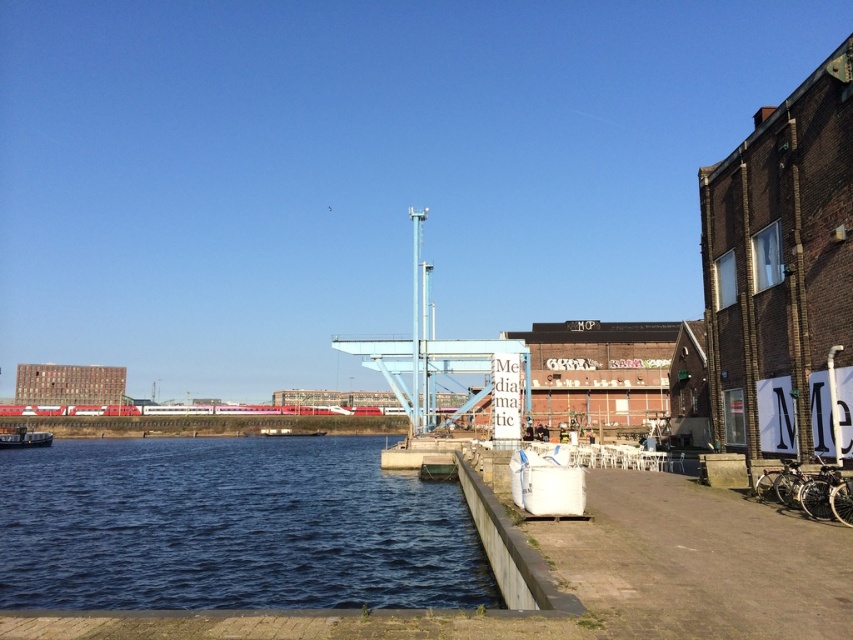
Question: Which point is closer to the camera taking this photo?

Choices:
 (A) [x=39, y=433]
 (B) [x=277, y=506]

Answer: (B)

Question: Is blue water at lower left to the left of metallic silver boat at lower left from the viewer's perspective?

Choices:
 (A) no
 (B) yes

Answer: (A)

Question: Is blue water at lower left to the left of metallic silver boat at lower left from the viewer's perspective?

Choices:
 (A) yes
 (B) no

Answer: (B)

Question: Which object appears farthest from the camera in this image?

Choices:
 (A) metallic silver boat at lower left
 (B) blue water at lower left

Answer: (A)

Question: Is blue water at lower left below metallic silver boat at lower left?

Choices:
 (A) no
 (B) yes

Answer: (A)

Question: Which point is farther from the camera taking this photo?

Choices:
 (A) (129, 467)
 (B) (39, 442)

Answer: (B)